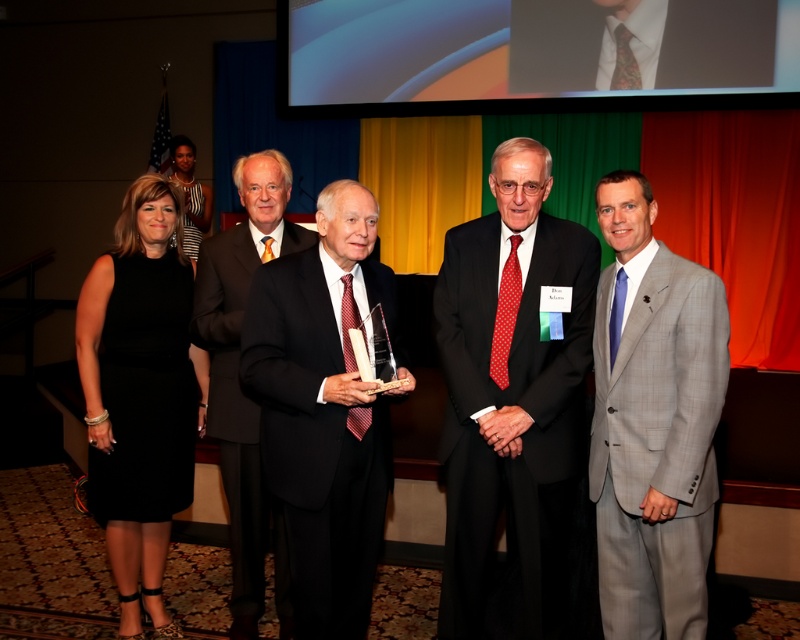
You are standing at point A at the center of the image. You want to walk to the closest person. Which direction should you go? The options are left, right, forward, backward, or any combination of these. The people are at the following coordinates relative to the center point A. The woman in the black dress is at point B at coordinates (374, 300). The man in the blue suit is at point C at coordinates 0.650, 0.350. The man in the gray suit is at point D at coordinates 0.320, 0.610. The man in the red tie,

The closest person to point A is the woman in the black dress at point B at coordinates (374, 300) because her distance is 0.469, which is less than the distances of the other people. Therefore, you should move towards the left and slightly forward to reach her.

You are a photographer at the event and need to capture a group photo of the gray checkered suit at right and the woman in the sleeveless black dress. The camera you are using has a maximum focus range of 6 feet. Can you capture both subjects in focus without moving either of them?

The gray checkered suit at right and the woman in the sleeveless black dress are 6.62 feet apart. Since the camera can only focus up to 6 feet, the distance between them exceeds the focus range. Therefore, you cannot capture both subjects in focus without moving them.